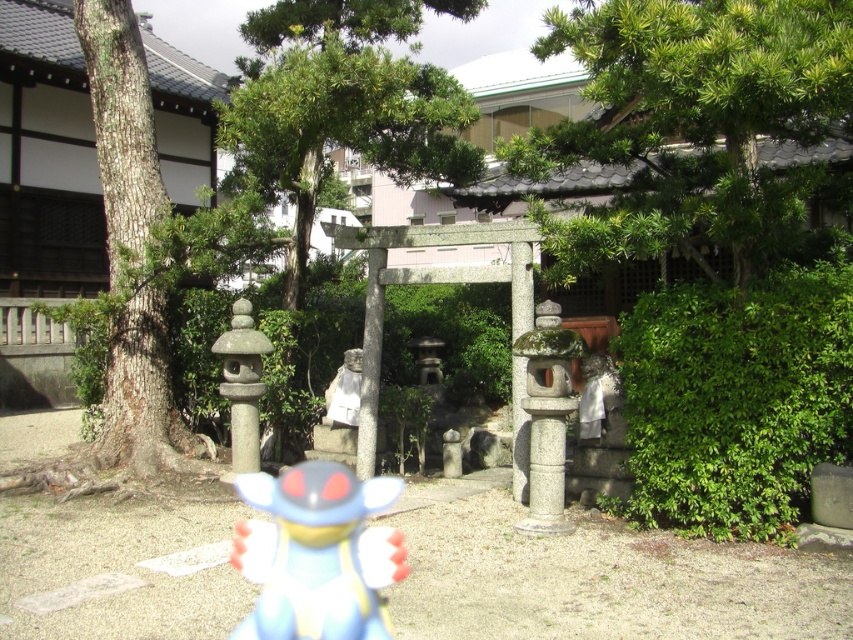
Question: Which object is closer to the camera taking this photo?

Choices:
 (A) matte stone statue at center
 (B) green leafy tree at upper center

Answer: (B)

Question: Does green leafy tree at upper center appear over brown rough bark tree at left?

Choices:
 (A) no
 (B) yes

Answer: (A)

Question: Which point is closer to the camera?

Choices:
 (A) shiny plastic toy at center
 (B) brown rough bark tree at left
 (C) green leafy tree at upper center

Answer: (A)

Question: Which of these objects is positioned closest to the green leafy tree at upper center?

Choices:
 (A) matte stone statue at center
 (B) shiny plastic toy at center
 (C) brown rough bark tree at left

Answer: (B)

Question: Does brown rough bark tree at left have a smaller size compared to matte stone statue at center?

Choices:
 (A) yes
 (B) no

Answer: (B)

Question: Does green leafy tree at upper center have a greater width compared to matte stone statue at center?

Choices:
 (A) no
 (B) yes

Answer: (B)